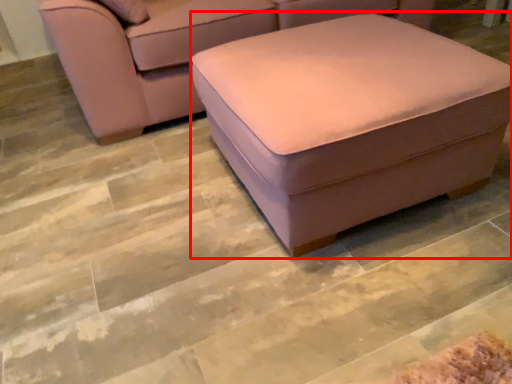
Question: Considering the relative positions of stool (annotated by the red box) and studio couch in the image provided, where is stool (annotated by the red box) located with respect to the staircase?

Choices:
 (A) right
 (B) left

Answer: (A)